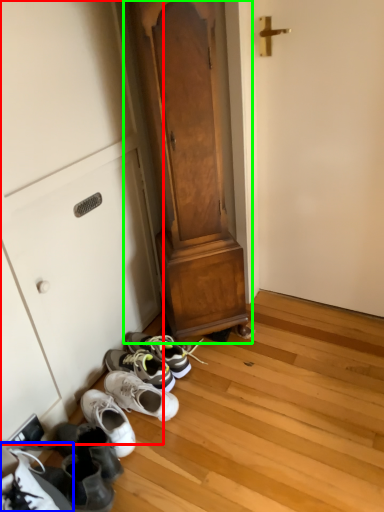
Question: Based on their relative distances, which object is farther from cabinetry (highlighted by a red box)? Choose from footwear (highlighted by a blue box) and dresser (highlighted by a green box).

Choices:
 (A) footwear
 (B) dresser

Answer: (A)